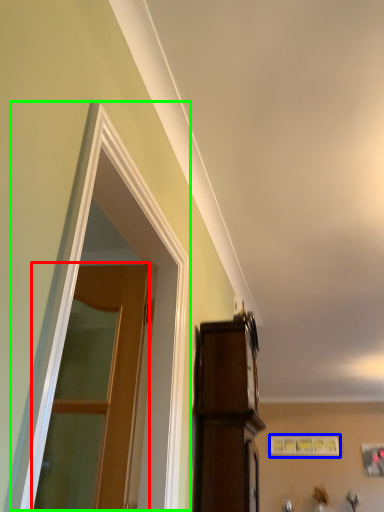
Question: Based on their relative distances, which object is nearer to door (highlighted by a red box)? Choose from picture frame (highlighted by a blue box) and window (highlighted by a green box).

Choices:
 (A) picture frame
 (B) window

Answer: (B)